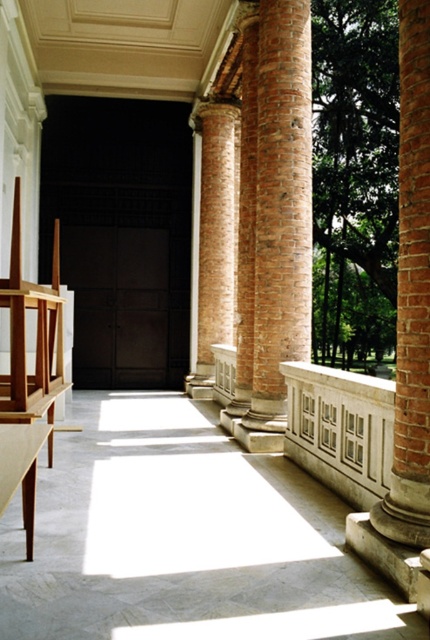
You are an architect designing a new corridor and want to ensure that the white stone balustrade at center and the brick textured column at center maintain a proportional relationship. Based on the image, which object is narrower?

The white stone balustrade at center is narrower than the brick textured column at center.

You are standing in the corridor and want to move from the white stone balustrade at center to the brick textured column at center. Which direction should you move to reach it?

The white stone balustrade at center is to the right of the brick textured column at center, so you should move to the left to reach the brick textured column at center.

Consider the image. You are an interior designer planning to place a large sculpture between the brick column at right and the brick textured column at center. Based on the space available between them, will the sculpture fit if it requires 3 meters of width?

The brick column at right occupies less space than the brick textured column at center, so the distance between them may vary. However, without specific measurements of the gap, it is uncertain if the sculpture requiring 3 meters of width will fit. Further spatial analysis is needed.